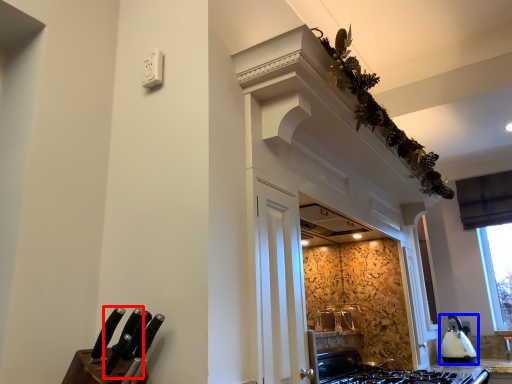
Question: Among these objects, which one is farthest to the camera, knife (highlighted by a red box) or kitchen appliance (highlighted by a blue box)?

Choices:
 (A) knife
 (B) kitchen appliance

Answer: (B)